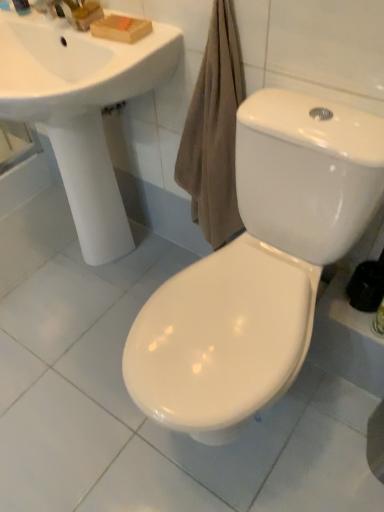
Where is `vacant space situated on the left part of white glossy toilet at center`? Image resolution: width=384 pixels, height=512 pixels. vacant space situated on the left part of white glossy toilet at center is located at coordinates (73, 380).